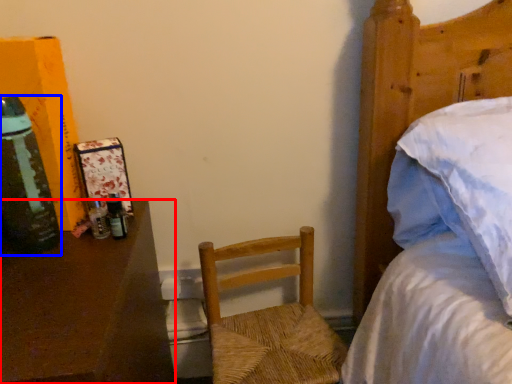
Question: Among these objects, which one is nearest to the camera, desk (highlighted by a red box) or bottle (highlighted by a blue box)?

Choices:
 (A) desk
 (B) bottle

Answer: (A)